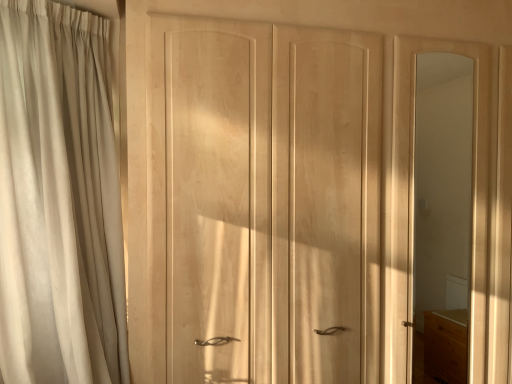
Question: In terms of width, does natural wood wardrobe at center look wider or thinner when compared to matte wood mirror at right?

Choices:
 (A) thin
 (B) wide

Answer: (B)

Question: From the image's perspective, is natural wood wardrobe at center positioned above or below matte wood mirror at right?

Choices:
 (A) above
 (B) below

Answer: (A)

Question: Which is nearer to the matte wood mirror at right?

Choices:
 (A) beige fabric curtain at left
 (B) natural wood wardrobe at center

Answer: (B)

Question: Which is nearer to the beige fabric curtain at left?

Choices:
 (A) matte wood mirror at right
 (B) natural wood wardrobe at center

Answer: (B)